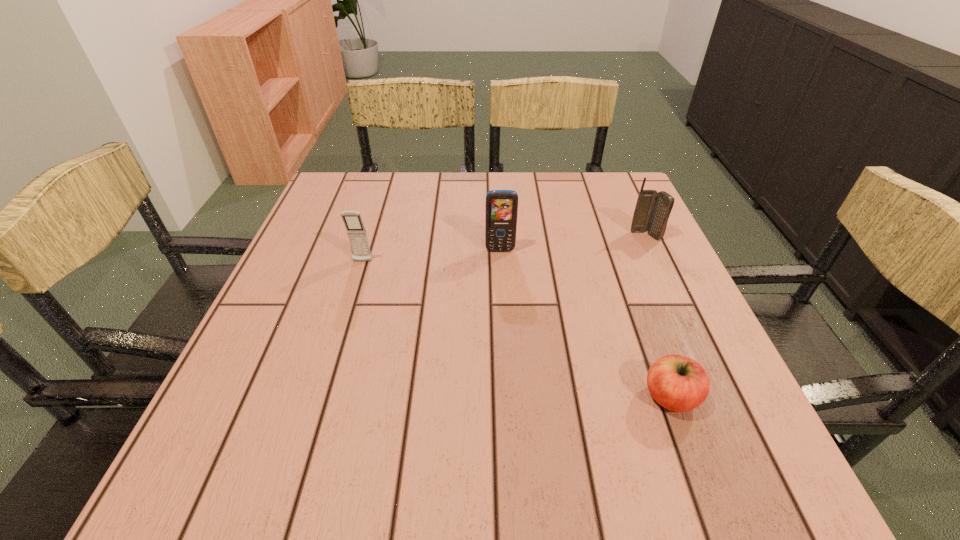
Where is `blank space at the near left corner of the desktop`? The image size is (960, 540). blank space at the near left corner of the desktop is located at coordinates (279, 496).

I want to click on vacant region at the far right corner of the desktop, so click(x=592, y=190).

Locate an element on the screen. The image size is (960, 540). free space between the third nearest object and the second nearest object is located at coordinates pos(431,256).

You are a GUI agent. You are given a task and a screenshot of the screen. Output one action in this format:
    pyautogui.click(x=<x>, y=<y>)
    Task: Click on the vacant space that's between the rightmost cellular telephone and the apple
    This screenshot has width=960, height=540.
    Given the screenshot: What is the action you would take?
    coord(658,316)

Locate an element on the screen. This screenshot has width=960, height=540. vacant space in between the rightmost object and the second object from left to right is located at coordinates (573, 243).

The image size is (960, 540). I want to click on blank region between the nearest object and the nearest cellular telephone, so click(x=516, y=329).

At what (x,y) coordinates should I click in order to perform the action: click on unoccupied position between the nearest cellular telephone and the third nearest object. Please return your answer as a coordinate pair (x, y). The image size is (960, 540). Looking at the image, I should click on (431, 256).

Where is `vacant area that lies between the third farthest object and the third nearest object`? vacant area that lies between the third farthest object and the third nearest object is located at coordinates (431, 256).

Locate an element on the screen. empty space between the second nearest object and the second farthest object is located at coordinates (431, 256).

The image size is (960, 540). I want to click on free point between the farthest cellular telephone and the third object from left to right, so click(x=658, y=316).